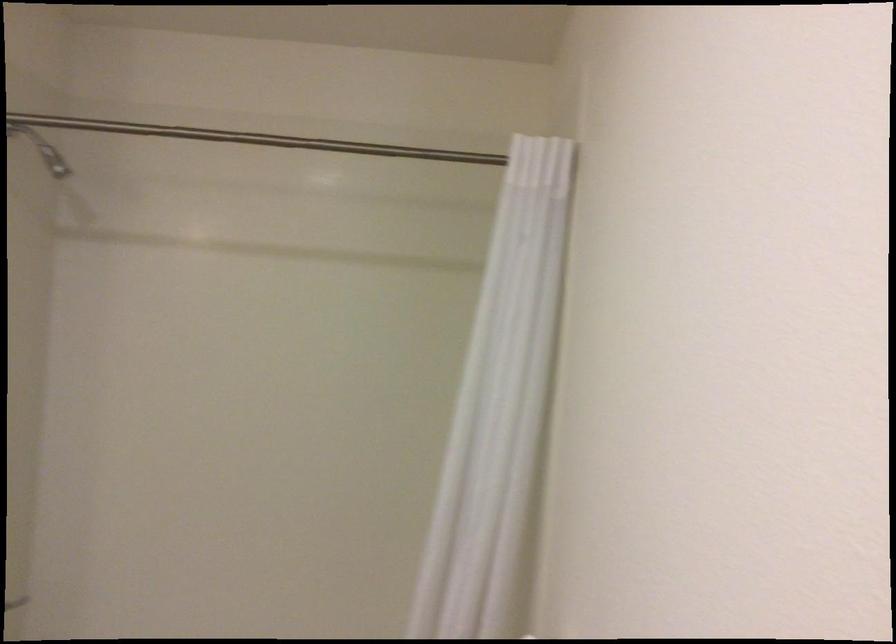
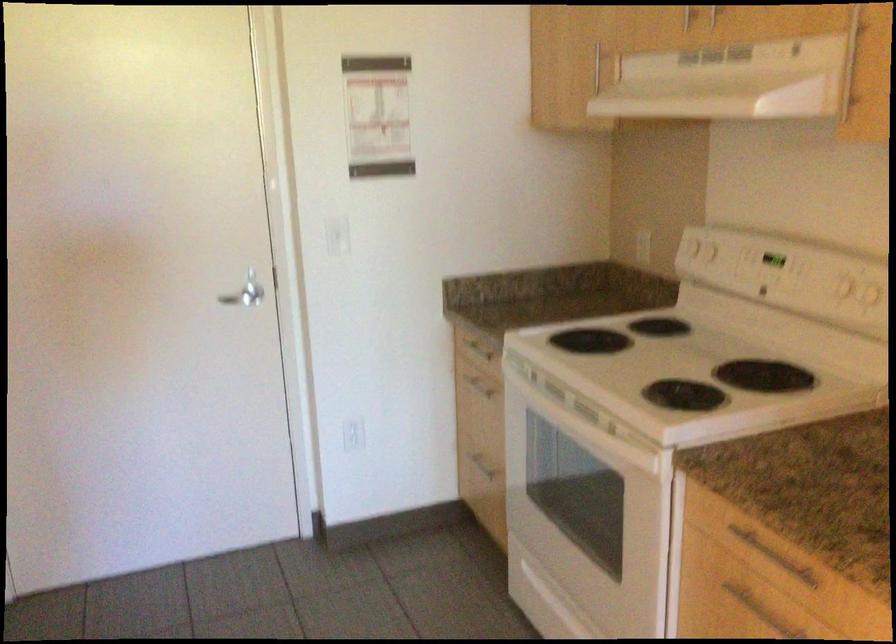
The first image is from the beginning of the video and the second image is from the end. How did the camera likely rotate when shooting the video?

The rotation direction of the camera is right-down.